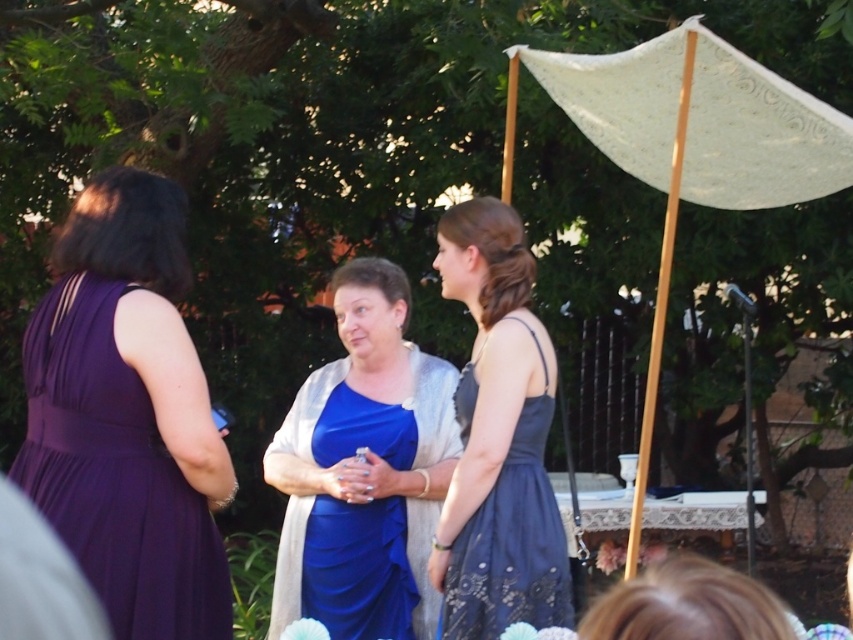
Can you confirm if matte blue dress at center is taller than purple satin dress at left?

Yes.

Is point (407, 536) behind point (157, 588)?

Yes, it is behind point (157, 588).

You are a GUI agent. You are given a task and a screenshot of the screen. Output one action in this format:
    pyautogui.click(x=<x>, y=<y>)
    Task: Click on the matte blue dress at center
    
    Given the screenshot: What is the action you would take?
    pyautogui.click(x=364, y=468)

Measure the distance from matte blue dress at center to navy lace dress at center.

matte blue dress at center and navy lace dress at center are 25.53 inches apart.

Where is `matte blue dress at center`? The width and height of the screenshot is (853, 640). matte blue dress at center is located at coordinates (364, 468).

I want to click on matte blue dress at center, so click(x=364, y=468).

You are a GUI agent. You are given a task and a screenshot of the screen. Output one action in this format:
    pyautogui.click(x=<x>, y=<y>)
    Task: Click on the purple satin dress at left
    
    Given the screenshot: What is the action you would take?
    pyautogui.click(x=115, y=476)

In the scene shown: Can you confirm if purple satin dress at left is smaller than white lace canopy at upper right?

Yes, purple satin dress at left is smaller than white lace canopy at upper right.

Is point (148, 492) positioned after point (724, 58)?

No, it is not.

Find the location of a particular element. This screenshot has height=640, width=853. purple satin dress at left is located at coordinates (115, 476).